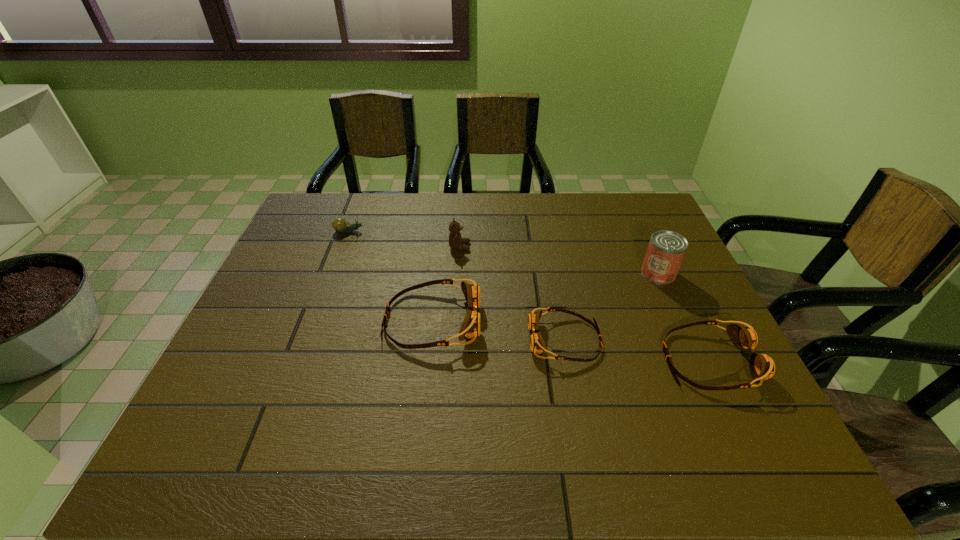
Where is `the tallest object`? The height and width of the screenshot is (540, 960). the tallest object is located at coordinates (666, 250).

The width and height of the screenshot is (960, 540). I want to click on vacant space positioned with the lenses facing forward on the leftmost goggles, so coord(563,320).

Locate an element on the screen. vacant area located with the lenses facing forward on the fourth object from left to right is located at coordinates (492, 340).

At what (x,y) coordinates should I click in order to perform the action: click on free space located 0.170m with the lenses facing forward on the fourth object from left to right. Please return your answer as a coordinate pair (x, y). The height and width of the screenshot is (540, 960). Looking at the image, I should click on (459, 340).

You are a GUI agent. You are given a task and a screenshot of the screen. Output one action in this format:
    pyautogui.click(x=<x>, y=<y>)
    Task: Click on the vacant position located with the lenses facing forward on the fourth object from left to right
    
    Given the screenshot: What is the action you would take?
    pyautogui.click(x=414, y=340)

At what (x,y) coordinates should I click in order to perform the action: click on vacant space located 0.110m on the front-facing side of the farthest object. Please return your answer as a coordinate pair (x, y). The width and height of the screenshot is (960, 540). Looking at the image, I should click on (399, 231).

Locate an element on the screen. The width and height of the screenshot is (960, 540). free space located at the face of the fifth shortest object is located at coordinates (598, 247).

The height and width of the screenshot is (540, 960). In order to click on blank space located 0.090m on the left of the tallest object in this screenshot , I will do `click(610, 274)`.

Image resolution: width=960 pixels, height=540 pixels. Find the location of `object that is at the far edge`. object that is at the far edge is located at coordinates (340, 225).

The width and height of the screenshot is (960, 540). I want to click on object that is at the near edge, so click(762, 367).